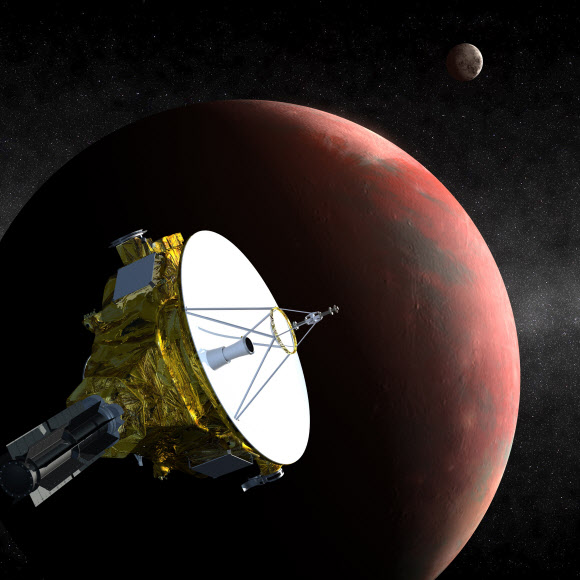
Where is `rod`? This screenshot has height=580, width=580. rod is located at coordinates (277, 377), (257, 377), (262, 347), (250, 332), (240, 311).